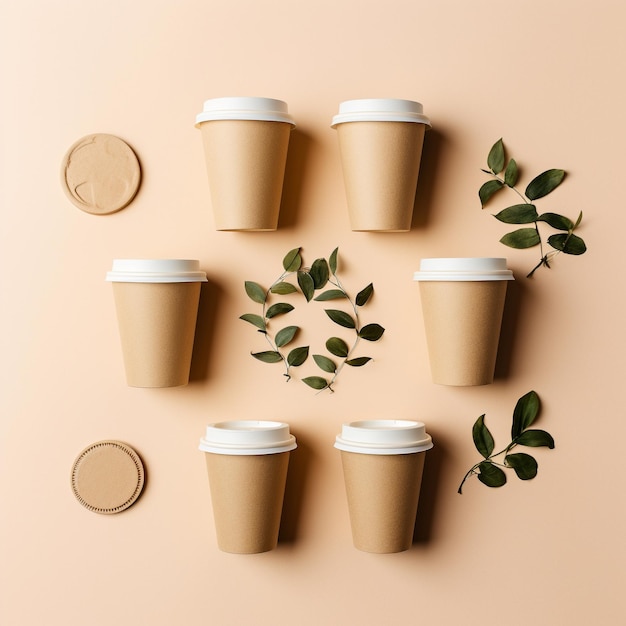
Identify the location of coffee cups. The width and height of the screenshot is (626, 626). (372, 133), (259, 198), (188, 330), (484, 295), (407, 480), (273, 496).